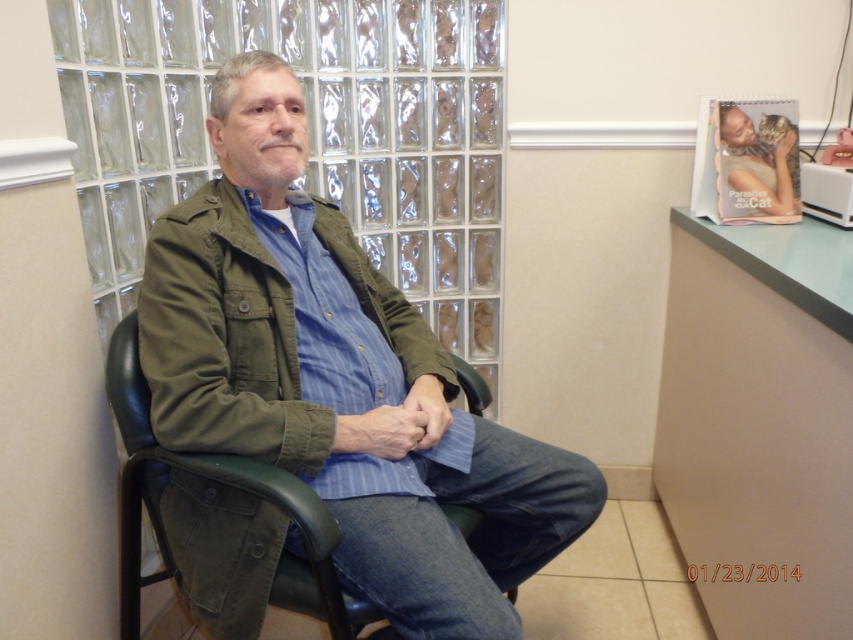
Does olive green fabric jacket at center appear on the left side of green leather chair at center?

In fact, olive green fabric jacket at center is to the right of green leather chair at center.

Who is positioned more to the left, olive green fabric jacket at center or green leather chair at center?

From the viewer's perspective, green leather chair at center appears more on the left side.

Where is `olive green fabric jacket at center`? The image size is (853, 640). olive green fabric jacket at center is located at coordinates (277, 339).

Which of these two, matte green jacket at center or olive green fabric jacket at center, stands shorter?

With less height is olive green fabric jacket at center.

Who is positioned more to the right, matte green jacket at center or olive green fabric jacket at center?

matte green jacket at center is more to the right.

I want to click on matte green jacket at center, so click(339, 381).

The height and width of the screenshot is (640, 853). Identify the location of matte green jacket at center. (339, 381).

Which of these two, matte green jacket at center or green leather chair at center, stands shorter?

green leather chair at center

Is matte green jacket at center to the right of green leather chair at center from the viewer's perspective?

Indeed, matte green jacket at center is positioned on the right side of green leather chair at center.

The image size is (853, 640). What do you see at coordinates (339, 381) in the screenshot?
I see `matte green jacket at center` at bounding box center [339, 381].

Identify the location of matte green jacket at center. (339, 381).